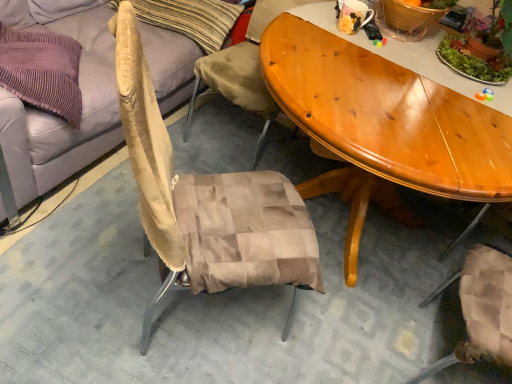
Identify the location of green leafy plant at upper right. (483, 49).

Identify the location of beige fabric pillow at upper left. The height and width of the screenshot is (384, 512). (191, 19).

Describe the element at coordinates (353, 16) in the screenshot. The image size is (512, 384). I see `matte ceramic mug at upper center` at that location.

You are a GUI agent. You are given a task and a screenshot of the screen. Output one action in this format:
    pyautogui.click(x=<x>, y=<y>)
    Task: Click on the green leafy plant at upper right
    This screenshot has height=384, width=512.
    Given the screenshot: What is the action you would take?
    pyautogui.click(x=483, y=49)

Can you confirm if green leafy plant at upper right is bigger than beige fabric couch at upper left?

Incorrect, green leafy plant at upper right is not larger than beige fabric couch at upper left.

Would you say green leafy plant at upper right is outside beige fabric couch at upper left?

Indeed, green leafy plant at upper right is completely outside beige fabric couch at upper left.

From a real-world perspective, is green leafy plant at upper right above or below beige fabric couch at upper left?

green leafy plant at upper right is above beige fabric couch at upper left.

Does point (469, 35) appear closer or farther from the camera than point (84, 107)?

Point (469, 35) appears to be closer to the viewer than point (84, 107).

From the image's perspective, is beige fabric couch at upper left on green leafy plant at upper right?

Correct, beige fabric couch at upper left appears higher than green leafy plant at upper right in the image.

Is beige fabric couch at upper left completely or partially outside of green leafy plant at upper right?

beige fabric couch at upper left lies outside green leafy plant at upper right's area.

Which object is further away from the camera, beige fabric couch at upper left or green leafy plant at upper right?

Positioned behind is green leafy plant at upper right.

Consider the image. Is beige fabric couch at upper left wider than green leafy plant at upper right?

Yes, beige fabric couch at upper left is wider than green leafy plant at upper right.

In order to click on pillow behind the green leafy plant at upper right in this screenshot , I will do pos(191,19).

In the scene shown: Considering the sizes of green leafy plant at upper right and beige fabric pillow at upper left in the image, is green leafy plant at upper right taller or shorter than beige fabric pillow at upper left?

Considering their sizes, green leafy plant at upper right has more height than beige fabric pillow at upper left.

Considering the positions of objects green leafy plant at upper right and beige fabric pillow at upper left in the image provided, who is more to the right, green leafy plant at upper right or beige fabric pillow at upper left?

From the viewer's perspective, green leafy plant at upper right appears more on the right side.

Is green leafy plant at upper right positioned with its back to beige fabric pillow at upper left?

No, green leafy plant at upper right is not facing the opposite direction of beige fabric pillow at upper left.

From the image's perspective, is matte ceramic mug at upper center above or below green leafy plant at upper right?

matte ceramic mug at upper center is above green leafy plant at upper right.

Is matte ceramic mug at upper center not close to green leafy plant at upper right?

They are positioned close to each other.

Identify the location of houseplant below the matte ceramic mug at upper center (from the image's perspective). This screenshot has width=512, height=384. (483, 49).

Which of these two, matte ceramic mug at upper center or green leafy plant at upper right, stands shorter?

Standing shorter between the two is matte ceramic mug at upper center.

From the image's perspective, between matte ceramic mug at upper center and beige fabric couch at upper left, who is located below?

matte ceramic mug at upper center, from the image's perspective.

You are a GUI agent. You are given a task and a screenshot of the screen. Output one action in this format:
    pyautogui.click(x=<x>, y=<y>)
    Task: Click on the coffee cup that appears behind the beige fabric couch at upper left
    
    Given the screenshot: What is the action you would take?
    pyautogui.click(x=353, y=16)

Is matte ceramic mug at upper center oriented towards beige fabric couch at upper left?

No, matte ceramic mug at upper center is not turned towards beige fabric couch at upper left.

Is point (50, 149) in front of point (348, 23)?

Yes, it is.

How distant is beige fabric couch at upper left from matte ceramic mug at upper center?

beige fabric couch at upper left is 1.04 meters from matte ceramic mug at upper center.

Is beige fabric couch at upper left turned away from matte ceramic mug at upper center?

No, beige fabric couch at upper left is not facing away from matte ceramic mug at upper center.

Is beige fabric couch at upper left taller or shorter than matte ceramic mug at upper center?

beige fabric couch at upper left is taller than matte ceramic mug at upper center.

Considering the positions of points (362, 19) and (201, 34), is point (362, 19) closer to camera compared to point (201, 34)?

That is True.

Is matte ceramic mug at upper center looking in the opposite direction of beige fabric pillow at upper left?

No, matte ceramic mug at upper center's orientation is not away from beige fabric pillow at upper left.

Are matte ceramic mug at upper center and beige fabric pillow at upper left making contact?

No, matte ceramic mug at upper center is not making contact with beige fabric pillow at upper left.

Looking at this image, considering the positions of objects matte ceramic mug at upper center and beige fabric pillow at upper left in the image provided, who is in front, matte ceramic mug at upper center or beige fabric pillow at upper left?

matte ceramic mug at upper center is closer to the camera.

Find the location of a particular element. This screenshot has width=512, height=384. studio couch on the left side of green leafy plant at upper right is located at coordinates coord(61,119).

Where is `studio couch located underneath the green leafy plant at upper right (from a real-world perspective)`? The image size is (512, 384). studio couch located underneath the green leafy plant at upper right (from a real-world perspective) is located at coordinates (61, 119).

Looking at the image, which one is located further to beige fabric pillow at upper left, green leafy plant at upper right or matte ceramic mug at upper center?

Among the two, green leafy plant at upper right is located further to beige fabric pillow at upper left.

Considering their positions, is beige fabric pillow at upper left positioned closer to green leafy plant at upper right than beige fabric couch at upper left?

beige fabric pillow at upper left lies closer to green leafy plant at upper right than the other object.

Based on their spatial positions, is green leafy plant at upper right or beige fabric couch at upper left further from matte ceramic mug at upper center?

Among the two, beige fabric couch at upper left is located further to matte ceramic mug at upper center.

Which object lies nearer to the anchor point matte ceramic mug at upper center, beige fabric pillow at upper left or beige fabric couch at upper left?

beige fabric pillow at upper left.

Based on their spatial positions, is matte ceramic mug at upper center or beige fabric pillow at upper left further from beige fabric couch at upper left?

matte ceramic mug at upper center lies further to beige fabric couch at upper left than the other object.

Based on their spatial positions, is beige fabric couch at upper left or green leafy plant at upper right closer to beige fabric pillow at upper left?

beige fabric couch at upper left is positioned closer to the anchor beige fabric pillow at upper left.

Consider the image. Considering their positions, is green leafy plant at upper right positioned closer to beige fabric pillow at upper left than beige fabric couch at upper left?

beige fabric couch at upper left lies closer to beige fabric pillow at upper left than the other object.

Considering their positions, is beige fabric pillow at upper left positioned closer to beige fabric couch at upper left than matte ceramic mug at upper center?

beige fabric pillow at upper left.

Identify the location of coffee cup located between beige fabric pillow at upper left and green leafy plant at upper right in the left-right direction. (353, 16).

You are a GUI agent. You are given a task and a screenshot of the screen. Output one action in this format:
    pyautogui.click(x=<x>, y=<y>)
    Task: Click on the pillow between beige fabric couch at upper left and matte ceramic mug at upper center in the horizontal direction
    
    Given the screenshot: What is the action you would take?
    191,19

Where is `pillow located between beige fabric couch at upper left and green leafy plant at upper right in the left-right direction`? This screenshot has width=512, height=384. pillow located between beige fabric couch at upper left and green leafy plant at upper right in the left-right direction is located at coordinates (191, 19).

Where is `coffee cup situated between beige fabric couch at upper left and green leafy plant at upper right from left to right`? The width and height of the screenshot is (512, 384). coffee cup situated between beige fabric couch at upper left and green leafy plant at upper right from left to right is located at coordinates (353, 16).